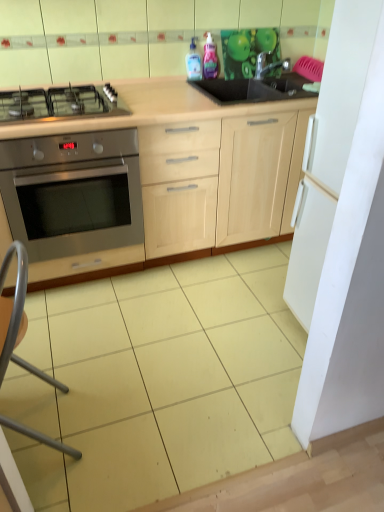
Where is `free point in front of transparent plastic bottle at upper center, the 1th bottle positioned from the left`? free point in front of transparent plastic bottle at upper center, the 1th bottle positioned from the left is located at coordinates (191, 82).